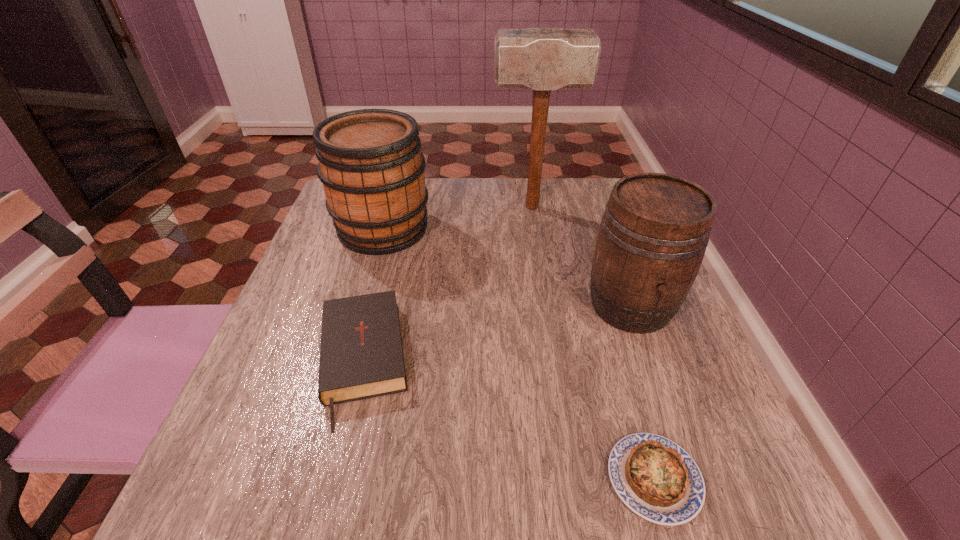
What are the coordinates of `object that stands as the third closest to the right cider` in the screenshot? It's located at (361, 356).

Where is `vacant area in the image that satisfies the following two spatial constraints: 1. on the striking face of the tallest object; 2. on the left side of the quiche`? Image resolution: width=960 pixels, height=540 pixels. vacant area in the image that satisfies the following two spatial constraints: 1. on the striking face of the tallest object; 2. on the left side of the quiche is located at coordinates (577, 479).